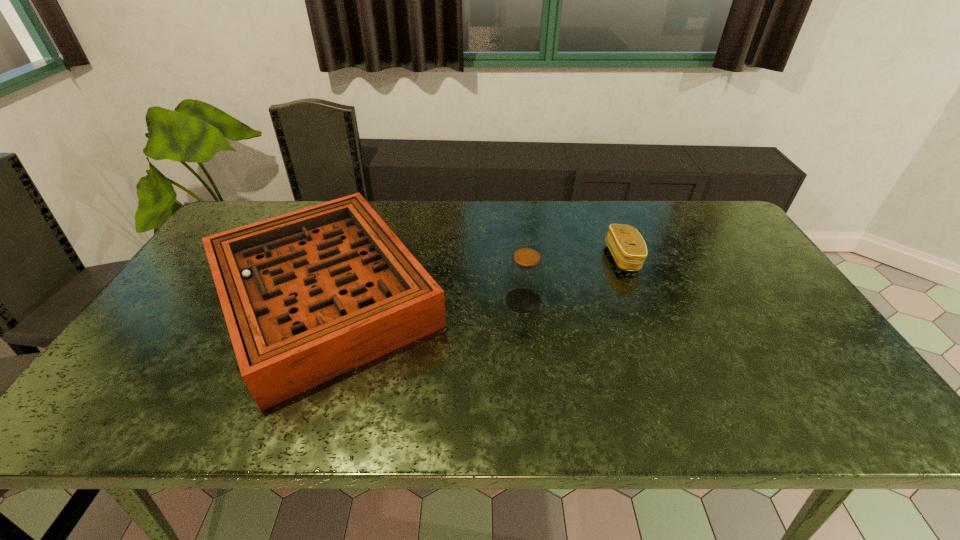
This screenshot has height=540, width=960. Identify the location of free space at the near left corner of the desktop. (118, 421).

Identify the location of free point at the far right corner. (693, 230).

Where is `free space between the clutch bag and the gameboard`? free space between the clutch bag and the gameboard is located at coordinates (474, 278).

Image resolution: width=960 pixels, height=540 pixels. I want to click on free space between the tallest object and the rightmost object, so click(x=573, y=279).

Where is `unoccupied position between the second tallest object and the shortest object`? The height and width of the screenshot is (540, 960). unoccupied position between the second tallest object and the shortest object is located at coordinates (474, 278).

Locate an element on the screen. Image resolution: width=960 pixels, height=540 pixels. vacant space that's between the clutch bag and the leftmost object is located at coordinates (474, 278).

What are the coordinates of `free spot between the second shortest object and the rightmost object` in the screenshot? It's located at (474, 278).

The width and height of the screenshot is (960, 540). I want to click on free space that is in between the gameboard and the rightmost object, so click(x=474, y=278).

Where is `vacant space that's between the leftmost object and the rightmost object`? vacant space that's between the leftmost object and the rightmost object is located at coordinates pyautogui.click(x=474, y=278).

This screenshot has height=540, width=960. What are the coordinates of `the second closest object to the jar` in the screenshot? It's located at (626, 244).